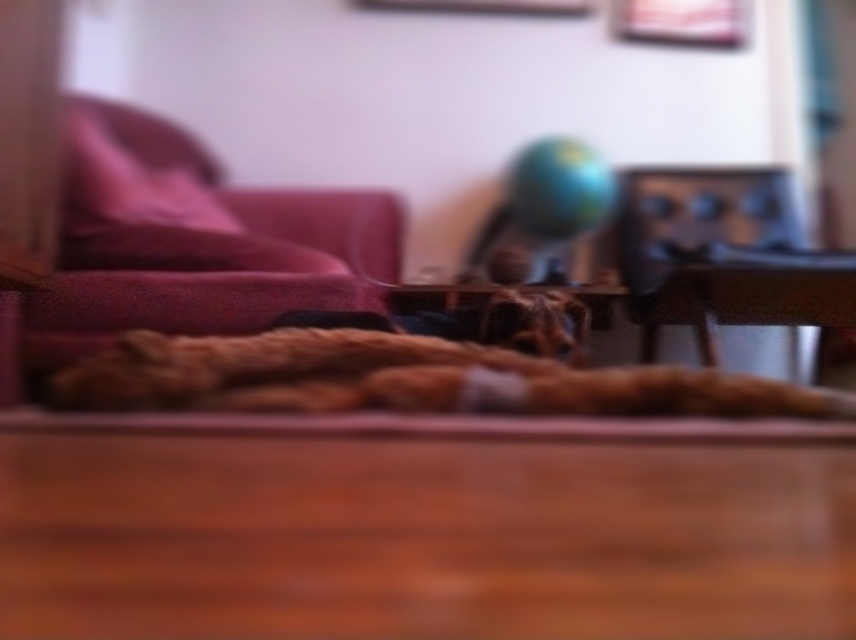
Is wooden picture frame at upper center to the left of metallic silver picture frame at upper center from the viewer's perspective?

In fact, wooden picture frame at upper center is to the right of metallic silver picture frame at upper center.

The width and height of the screenshot is (856, 640). Describe the element at coordinates (682, 20) in the screenshot. I see `wooden picture frame at upper center` at that location.

What do you see at coordinates (682, 20) in the screenshot? The image size is (856, 640). I see `wooden picture frame at upper center` at bounding box center [682, 20].

Find the location of `wooden picture frame at upper center`. wooden picture frame at upper center is located at coordinates (682, 20).

Is shiny metallic globe at center bigger than wooden picture frame at upper center?

Correct, shiny metallic globe at center is larger in size than wooden picture frame at upper center.

This screenshot has height=640, width=856. What do you see at coordinates (548, 200) in the screenshot? I see `shiny metallic globe at center` at bounding box center [548, 200].

Where is `shiny metallic globe at center`? shiny metallic globe at center is located at coordinates (548, 200).

Find the location of a particular element. fluffy brown dog at center is located at coordinates (406, 380).

Can you confirm if fluffy brown dog at center is positioned to the left of wooden picture frame at upper center?

Correct, you'll find fluffy brown dog at center to the left of wooden picture frame at upper center.

In order to click on fluffy brown dog at center in this screenshot , I will do `click(406, 380)`.